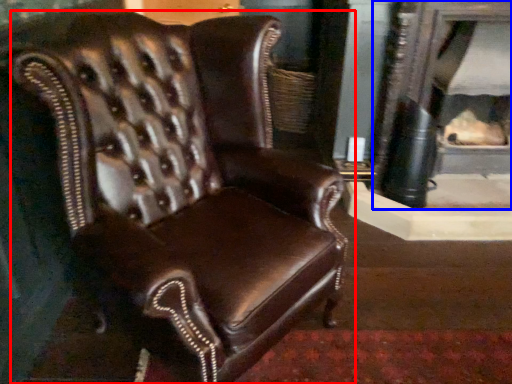
Question: Which object is further to the camera taking this photo, chair (highlighted by a red box) or fireplace (highlighted by a blue box)?

Choices:
 (A) chair
 (B) fireplace

Answer: (B)